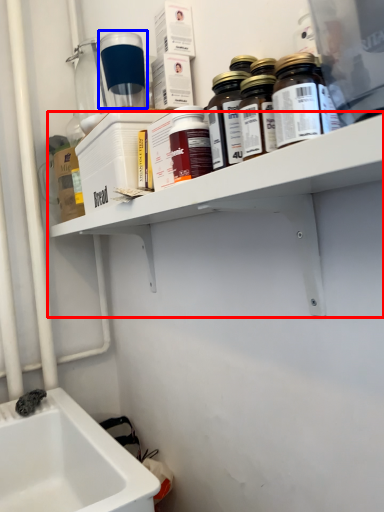
Question: Which point is further to the camera, shelf (highlighted by a red box) or bottle (highlighted by a blue box)?

Choices:
 (A) shelf
 (B) bottle

Answer: (B)